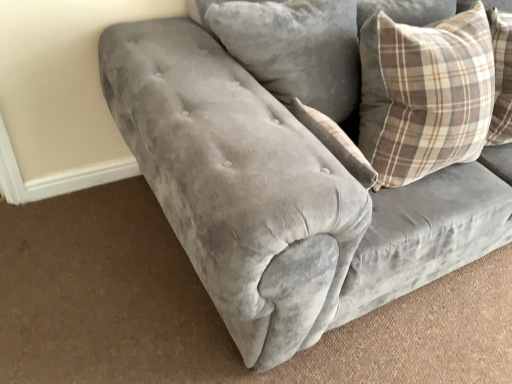
Question: Is plaid fabric pillow at upper right, the 1th pillow from the right, wider or thinner than plaid fabric pillow at upper right, arranged as the 2th pillow when viewed from the right?

Choices:
 (A) thin
 (B) wide

Answer: (A)

Question: Considering the positions of plaid fabric pillow at upper right, which appears as the second pillow when viewed from the left, and plaid fabric pillow at upper right, arranged as the 2th pillow when viewed from the right, in the image, is plaid fabric pillow at upper right, which appears as the second pillow when viewed from the left, taller or shorter than plaid fabric pillow at upper right, arranged as the 2th pillow when viewed from the right,?

Choices:
 (A) tall
 (B) short

Answer: (B)

Question: Considering the relative positions of plaid fabric pillow at upper right, which appears as the second pillow when viewed from the left, and plaid fabric pillow at upper right, arranged as the 2th pillow when viewed from the right, in the image provided, is plaid fabric pillow at upper right, which appears as the second pillow when viewed from the left, to the left or to the right of plaid fabric pillow at upper right, arranged as the 2th pillow when viewed from the right,?

Choices:
 (A) right
 (B) left

Answer: (A)

Question: Does point (358, 74) appear closer or farther from the camera than point (433, 59)?

Choices:
 (A) closer
 (B) farther

Answer: (B)

Question: From a real-world perspective, is plaid fabric pillow at upper right, arranged as the 2th pillow when viewed from the right, positioned above or below plaid fabric pillow at upper right, the 1th pillow from the right?

Choices:
 (A) above
 (B) below

Answer: (A)

Question: Is plaid fabric pillow at upper right, placed as the first pillow when sorted from left to right, in front of or behind plaid fabric pillow at upper right, the 1th pillow from the right, in the image?

Choices:
 (A) behind
 (B) front

Answer: (A)

Question: Is plaid fabric pillow at upper right, arranged as the 2th pillow when viewed from the right, inside or outside of plaid fabric pillow at upper right, the 1th pillow from the right?

Choices:
 (A) inside
 (B) outside

Answer: (B)